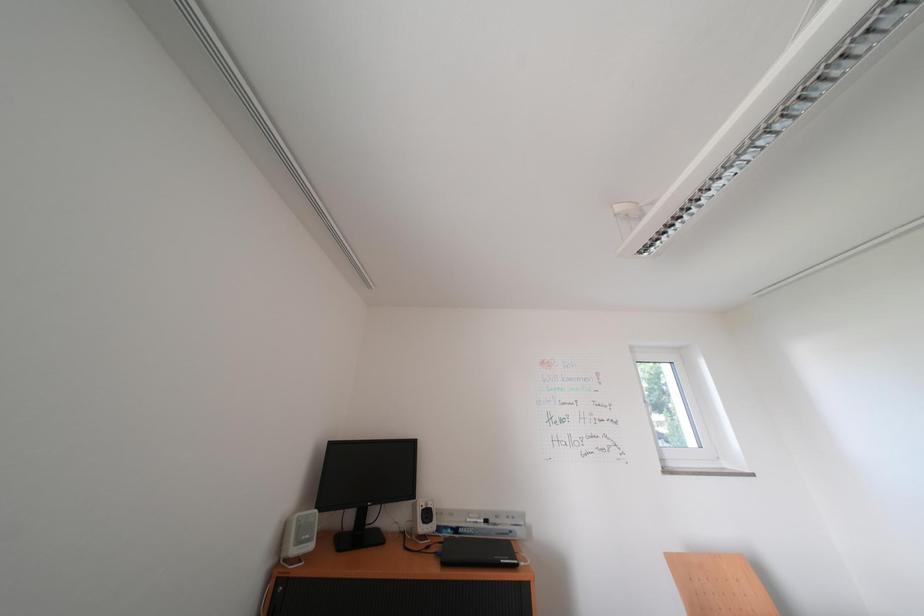
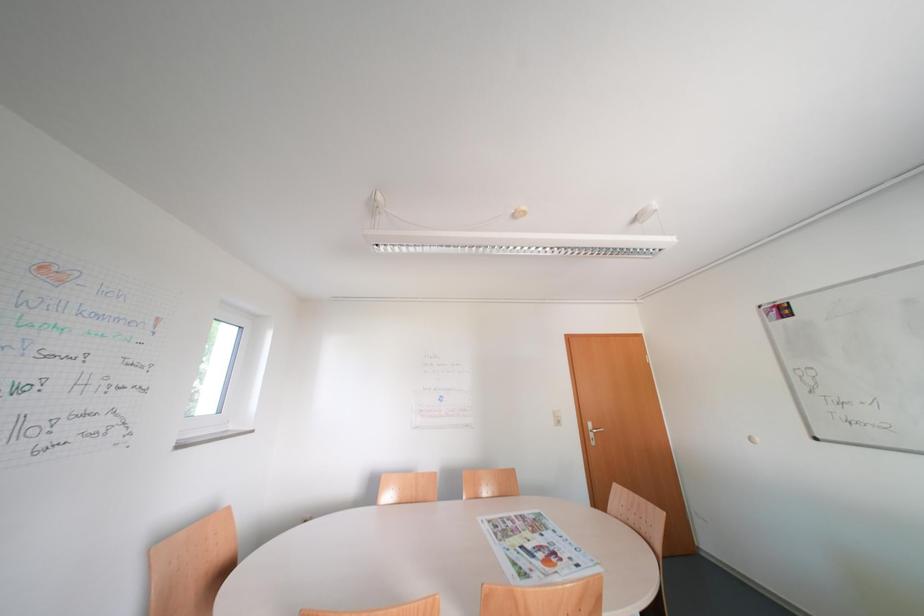
The first image is from the beginning of the video and the second image is from the end. How did the camera likely rotate when shooting the video?

The camera rotated toward right-up.